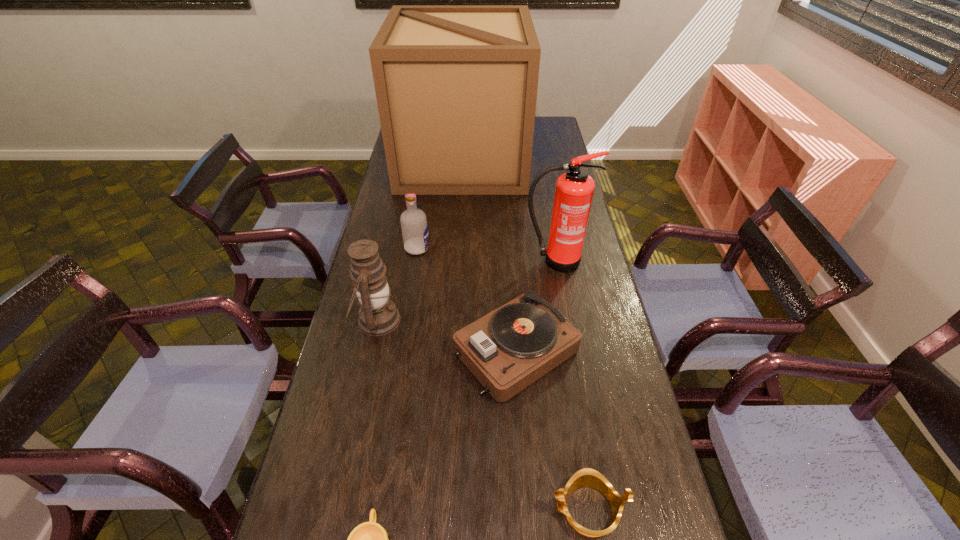
Locate an element on the screen. Image resolution: width=960 pixels, height=540 pixels. the tallest object is located at coordinates (456, 86).

Identify the location of the farthest object. The height and width of the screenshot is (540, 960). (456, 86).

Locate an element on the screen. The image size is (960, 540). the sixth shortest object is located at coordinates [x=574, y=189].

Find the location of a particular element. the fifth shortest object is located at coordinates (378, 315).

At what (x,y) coordinates should I click in order to perform the action: click on the fourth tallest object. Please return your answer as a coordinate pair (x, y). Looking at the image, I should click on (414, 225).

Identify the location of the fifth tallest object. This screenshot has width=960, height=540. (510, 348).

The width and height of the screenshot is (960, 540). In order to click on free space located on the reinforced sides of the box in this screenshot , I will do `click(540, 160)`.

Locate an element on the screen. The image size is (960, 540). blank space located at the nozzle of the fire extinguisher is located at coordinates 569,343.

The image size is (960, 540). Identify the location of free location located 0.170m on the back of the third tallest object. (390, 262).

Identify the location of free space located on the label of the vodka. (529, 248).